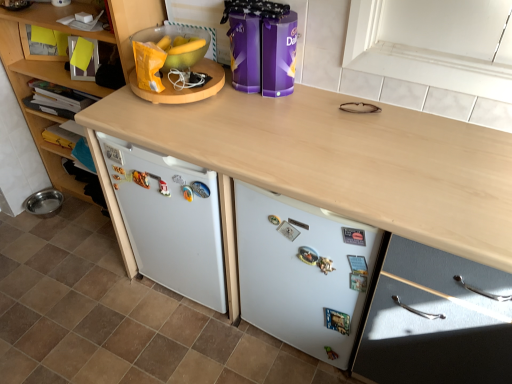
Describe the element at coordinates (436, 320) in the screenshot. I see `light wood/texture drawer at lower right, arranged as the second cabinetry when viewed from the left` at that location.

The height and width of the screenshot is (384, 512). Describe the element at coordinates (63, 66) in the screenshot. I see `wooden cabinet at left, the second cabinetry viewed from the right` at that location.

This screenshot has width=512, height=384. What are the coordinates of `white matte refrigerator at lower center` in the screenshot? It's located at (303, 272).

How much space does yellow paper bag at upper left, which appears as the 2th appliance when viewed from the right, occupy horizontally?

yellow paper bag at upper left, which appears as the 2th appliance when viewed from the right, is 9.60 inches in width.

What do you see at coordinates (183, 89) in the screenshot?
I see `yellow paper bag at upper left, placed as the 1th appliance when sorted from left to right` at bounding box center [183, 89].

Locate an element on the screen. This screenshot has width=512, height=384. light wood/texture drawer at lower right, which is the 1th cabinetry from right to left is located at coordinates (436, 320).

Considering the sizes of wooden cabinet at left, the second cabinetry viewed from the right, and white matte refrigerator at lower center in the image, is wooden cabinet at left, the second cabinetry viewed from the right, taller or shorter than white matte refrigerator at lower center?

Considering their sizes, wooden cabinet at left, the second cabinetry viewed from the right, has more height than white matte refrigerator at lower center.

From the image's perspective, is wooden cabinet at left, the 1th cabinetry in the left-to-right sequence, above white matte refrigerator at lower center?

Yes, from the image's perspective, wooden cabinet at left, the 1th cabinetry in the left-to-right sequence, is on top of white matte refrigerator at lower center.

Which object is thinner, wooden cabinet at left, the second cabinetry viewed from the right, or white matte refrigerator at lower center?

white matte refrigerator at lower center is thinner.

How far apart are wooden cabinet at left, the 1th cabinetry in the left-to-right sequence, and white matte refrigerator at lower center?

1.03 meters.

Is white glossy tile at lower center aimed at wooden cabinet at left, the 1th cabinetry in the left-to-right sequence?

No.

Are white glossy tile at lower center and wooden cabinet at left, the 1th cabinetry in the left-to-right sequence, far apart?

That's not correct — white glossy tile at lower center is a little close to wooden cabinet at left, the 1th cabinetry in the left-to-right sequence.

How many degrees apart are the facing directions of white glossy tile at lower center and wooden cabinet at left, the second cabinetry viewed from the right?

The angle between the facing direction of white glossy tile at lower center and the facing direction of wooden cabinet at left, the second cabinetry viewed from the right, is 90.9 degrees.

Is white glossy tile at lower center further to camera compared to wooden cabinet at left, the 1th cabinetry in the left-to-right sequence?

No, white glossy tile at lower center is closer to the viewer.

Between wooden cabinet at left, the 1th cabinetry in the left-to-right sequence, and white glossy tile at lower center, which one appears on the right side from the viewer's perspective?

Positioned to the right is white glossy tile at lower center.

In the scene shown: Which object is closer to the camera, wooden cabinet at left, the second cabinetry viewed from the right, or white glossy tile at lower center?

white glossy tile at lower center is more forward.

Identify the location of cabinetry that is the 2nd object located above the white glossy tile at lower center (from the image's perspective). Image resolution: width=512 pixels, height=384 pixels. (63, 66).

Is white glossy tile at lower center inside wooden cabinet at left, the second cabinetry viewed from the right?

Definitely not — white glossy tile at lower center is not inside wooden cabinet at left, the second cabinetry viewed from the right.

Can you confirm if yellow paper bag at upper left, which appears as the 2th appliance when viewed from the right, is thinner than light wood/texture drawer at lower right, which is the 1th cabinetry from right to left?

Correct, the width of yellow paper bag at upper left, which appears as the 2th appliance when viewed from the right, is less than that of light wood/texture drawer at lower right, which is the 1th cabinetry from right to left.

Image resolution: width=512 pixels, height=384 pixels. In order to click on cabinetry in front of the yellow paper bag at upper left, placed as the 1th appliance when sorted from left to right in this screenshot , I will do `click(436, 320)`.

Is yellow paper bag at upper left, which appears as the 2th appliance when viewed from the right, to the left of light wood/texture drawer at lower right, arranged as the second cabinetry when viewed from the left, from the viewer's perspective?

Yes.

From a real-world perspective, is yellow paper bag at upper left, which appears as the 2th appliance when viewed from the right, above or below light wood/texture drawer at lower right, arranged as the second cabinetry when viewed from the left?

Clearly, from a real-world perspective, yellow paper bag at upper left, which appears as the 2th appliance when viewed from the right, is above light wood/texture drawer at lower right, arranged as the second cabinetry when viewed from the left.

Considering the sizes of light wood/texture drawer at lower right, arranged as the second cabinetry when viewed from the left, and white glossy tile at lower center in the image, is light wood/texture drawer at lower right, arranged as the second cabinetry when viewed from the left, taller or shorter than white glossy tile at lower center?

light wood/texture drawer at lower right, arranged as the second cabinetry when viewed from the left, is taller than white glossy tile at lower center.

Would you consider light wood/texture drawer at lower right, arranged as the second cabinetry when viewed from the left, to be distant from white glossy tile at lower center?

light wood/texture drawer at lower right, arranged as the second cabinetry when viewed from the left, is actually quite close to white glossy tile at lower center.

Is light wood/texture drawer at lower right, arranged as the second cabinetry when viewed from the left, oriented away from white glossy tile at lower center?

No, light wood/texture drawer at lower right, arranged as the second cabinetry when viewed from the left, is not facing away from white glossy tile at lower center.

From the image's perspective, is white glossy tile at lower center located above or below yellow paper bag at upper left, which appears as the 2th appliance when viewed from the right?

white glossy tile at lower center is situated lower than yellow paper bag at upper left, which appears as the 2th appliance when viewed from the right, in the image.

Is white glossy tile at lower center turned away from yellow paper bag at upper left, placed as the 1th appliance when sorted from left to right?

No, white glossy tile at lower center is not facing the opposite direction of yellow paper bag at upper left, placed as the 1th appliance when sorted from left to right.

Considering the sizes of objects white glossy tile at lower center and yellow paper bag at upper left, placed as the 1th appliance when sorted from left to right, in the image provided, who is shorter, white glossy tile at lower center or yellow paper bag at upper left, placed as the 1th appliance when sorted from left to right,?

With less height is white glossy tile at lower center.

Does white glossy tile at lower center have a greater width compared to yellow paper bag at upper left, placed as the 1th appliance when sorted from left to right?

Yes, white glossy tile at lower center is wider than yellow paper bag at upper left, placed as the 1th appliance when sorted from left to right.

Which object is more forward, light wood/texture drawer at lower right, arranged as the second cabinetry when viewed from the left, or purple glossy chocolate tins at center, arranged as the 2th appliance when viewed from the left?

light wood/texture drawer at lower right, arranged as the second cabinetry when viewed from the left, is closer to the camera.

Is light wood/texture drawer at lower right, arranged as the second cabinetry when viewed from the left, facing away from purple glossy chocolate tins at center, positioned as the 1th appliance in right-to-left order?

No.

Does light wood/texture drawer at lower right, which is the 1th cabinetry from right to left, have a greater width compared to purple glossy chocolate tins at center, arranged as the 2th appliance when viewed from the left?

Indeed, light wood/texture drawer at lower right, which is the 1th cabinetry from right to left, has a greater width compared to purple glossy chocolate tins at center, arranged as the 2th appliance when viewed from the left.

Considering the sizes of light wood/texture drawer at lower right, arranged as the second cabinetry when viewed from the left, and purple glossy chocolate tins at center, arranged as the 2th appliance when viewed from the left, in the image, is light wood/texture drawer at lower right, arranged as the second cabinetry when viewed from the left, bigger or smaller than purple glossy chocolate tins at center, arranged as the 2th appliance when viewed from the left,?

light wood/texture drawer at lower right, arranged as the second cabinetry when viewed from the left, is bigger than purple glossy chocolate tins at center, arranged as the 2th appliance when viewed from the left.

This screenshot has height=384, width=512. What are the coordinates of `refrigerator in front of the wooden cabinet at left, the 1th cabinetry in the left-to-right sequence` in the screenshot? It's located at (303, 272).

This screenshot has height=384, width=512. I want to click on cabinetry that appears behind the white glossy tile at lower center, so click(x=63, y=66).

Which object lies further to the anchor point white matte refrigerator at lower center, white glossy tile at lower center or yellow paper bag at upper left, which appears as the 2th appliance when viewed from the right?

yellow paper bag at upper left, which appears as the 2th appliance when viewed from the right, lies further to white matte refrigerator at lower center than the other object.

Based on their spatial positions, is wooden cabinet at left, the 1th cabinetry in the left-to-right sequence, or white matte refrigerator at lower center closer to purple glossy chocolate tins at center, positioned as the 1th appliance in right-to-left order?

Based on the image, wooden cabinet at left, the 1th cabinetry in the left-to-right sequence, appears to be nearer to purple glossy chocolate tins at center, positioned as the 1th appliance in right-to-left order.

When comparing their distances from white glossy tile at lower center, does purple glossy chocolate tins at center, arranged as the 2th appliance when viewed from the left, or wooden cabinet at left, the 1th cabinetry in the left-to-right sequence, seem further?

The object further to white glossy tile at lower center is purple glossy chocolate tins at center, arranged as the 2th appliance when viewed from the left.

Based on their spatial positions, is yellow paper bag at upper left, which appears as the 2th appliance when viewed from the right, or white glossy tile at lower center further from light wood/texture drawer at lower right, which is the 1th cabinetry from right to left?

Based on the image, yellow paper bag at upper left, which appears as the 2th appliance when viewed from the right, appears to be further to light wood/texture drawer at lower right, which is the 1th cabinetry from right to left.

Estimate the real-world distances between objects in this image. Which object is further from wooden cabinet at left, the second cabinetry viewed from the right, white glossy tile at lower center or yellow paper bag at upper left, placed as the 1th appliance when sorted from left to right?

Based on the image, white glossy tile at lower center appears to be further to wooden cabinet at left, the second cabinetry viewed from the right.

Considering their positions, is white matte refrigerator at lower center positioned further to yellow paper bag at upper left, placed as the 1th appliance when sorted from left to right, than light wood/texture drawer at lower right, which is the 1th cabinetry from right to left?

light wood/texture drawer at lower right, which is the 1th cabinetry from right to left, lies further to yellow paper bag at upper left, placed as the 1th appliance when sorted from left to right, than the other object.

Estimate the real-world distances between objects in this image. Which object is closer to light wood/texture drawer at lower right, arranged as the second cabinetry when viewed from the left, purple glossy chocolate tins at center, arranged as the 2th appliance when viewed from the left, or white matte refrigerator at lower center?

white matte refrigerator at lower center lies closer to light wood/texture drawer at lower right, arranged as the second cabinetry when viewed from the left, than the other object.

Which object lies further to the anchor point white matte refrigerator at lower center, light wood/texture drawer at lower right, which is the 1th cabinetry from right to left, or white glossy tile at lower center?

white glossy tile at lower center.

Image resolution: width=512 pixels, height=384 pixels. Identify the location of refrigerator located between yellow paper bag at upper left, which appears as the 2th appliance when viewed from the right, and light wood/texture drawer at lower right, which is the 1th cabinetry from right to left, in the left-right direction. (303, 272).

Locate an element on the screen. The height and width of the screenshot is (384, 512). refrigerator between yellow paper bag at upper left, placed as the 1th appliance when sorted from left to right, and white glossy tile at lower center from top to bottom is located at coordinates coord(303,272).

Locate an element on the screen. tile between wooden cabinet at left, the second cabinetry viewed from the right, and white matte refrigerator at lower center is located at coordinates (118, 317).

Image resolution: width=512 pixels, height=384 pixels. Identify the location of appliance between yellow paper bag at upper left, which appears as the 2th appliance when viewed from the right, and white glossy tile at lower center, in the vertical direction. (262, 46).